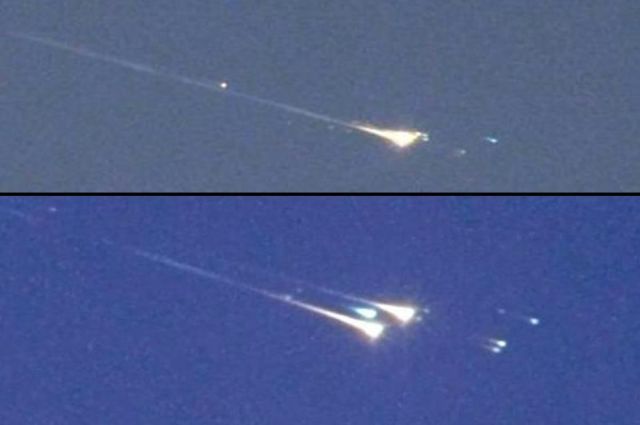
Identify the location of 3 smaller lights in in upper image. The image size is (640, 425). (490, 144), (463, 158), (220, 80).